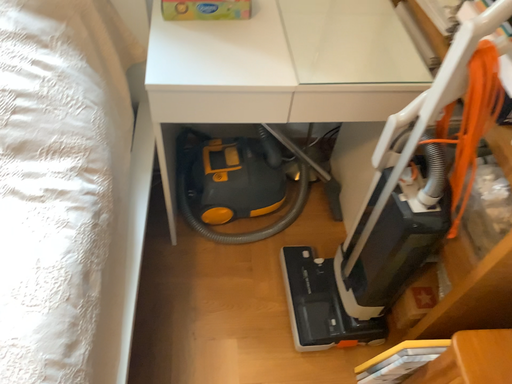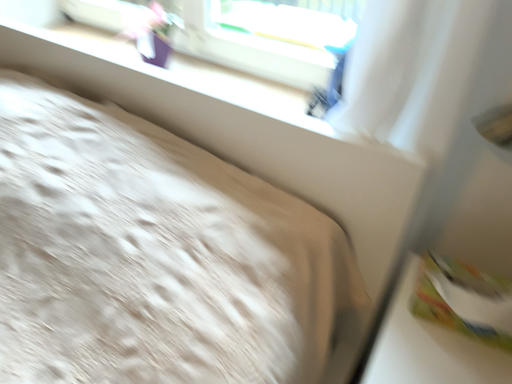
Question: Which way did the camera rotate in the video?

Choices:
 (A) rotated downward
 (B) rotated upward

Answer: (B)